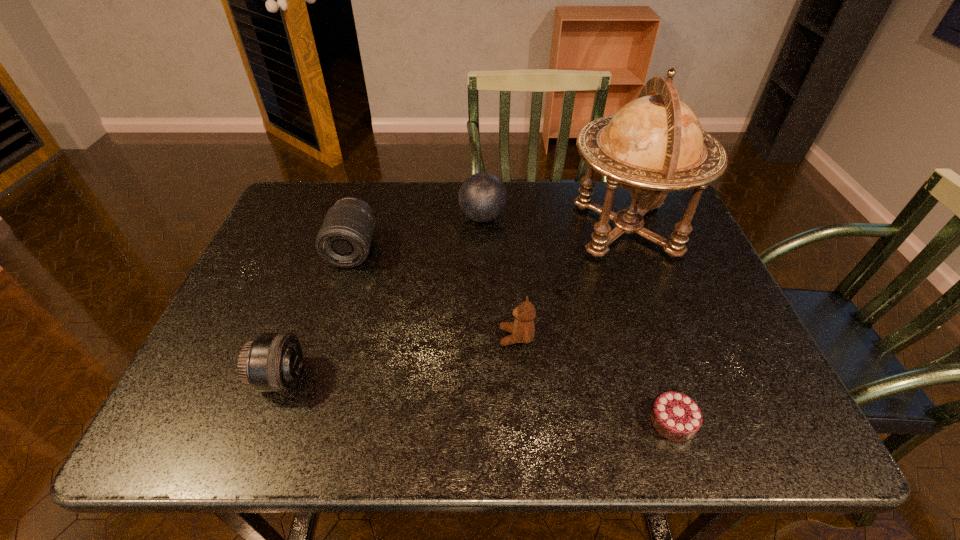
Where is `free space between the nearer telephoto lens and the shortest object`? The width and height of the screenshot is (960, 540). free space between the nearer telephoto lens and the shortest object is located at coordinates (477, 400).

The height and width of the screenshot is (540, 960). Find the location of `vacant area between the bowling ball and the globe`. vacant area between the bowling ball and the globe is located at coordinates (555, 223).

Identify the location of free space between the globe and the bowling ball. (555, 223).

Locate an element on the screen. The width and height of the screenshot is (960, 540). object that ranks as the fifth closest to the globe is located at coordinates (272, 362).

Point out which object is positioned as the third nearest to the nearer telephoto lens. Please provide its 2D coordinates. Your answer should be formatted as a tuple, i.e. [(x, y)], where the tuple contains the x and y coordinates of a point satisfying the conditions above.

[(482, 197)]

Locate an element on the screen. The height and width of the screenshot is (540, 960). free space that satisfies the following two spatial constraints: 1. on the surface of the farther telephoto lens; 2. on the front-facing side of the nearer telephoto lens is located at coordinates (314, 378).

What are the coordinates of `vacant space that satisfies the following two spatial constraints: 1. on the surface of the farther telephoto lens; 2. on the right side of the chocolate cake` in the screenshot? It's located at (300, 421).

Where is `blank area in the image that satisfies the following two spatial constraints: 1. on the back side of the shortest object; 2. on the front-facing side of the nearer telephoto lens`? This screenshot has height=540, width=960. blank area in the image that satisfies the following two spatial constraints: 1. on the back side of the shortest object; 2. on the front-facing side of the nearer telephoto lens is located at coordinates (659, 378).

This screenshot has width=960, height=540. Identify the location of free space that satisfies the following two spatial constraints: 1. on the surface of the farther telephoto lens; 2. on the front-facing side of the nearer telephoto lens. (314, 378).

You are a GUI agent. You are given a task and a screenshot of the screen. Output one action in this format:
    pyautogui.click(x=<x>, y=<y>)
    Task: Click on the free space that satisfies the following two spatial constraints: 1. on the surface of the chocolate cake; 2. on the right side of the farther telephoto lens
    The image size is (960, 540).
    Given the screenshot: What is the action you would take?
    pyautogui.click(x=300, y=421)